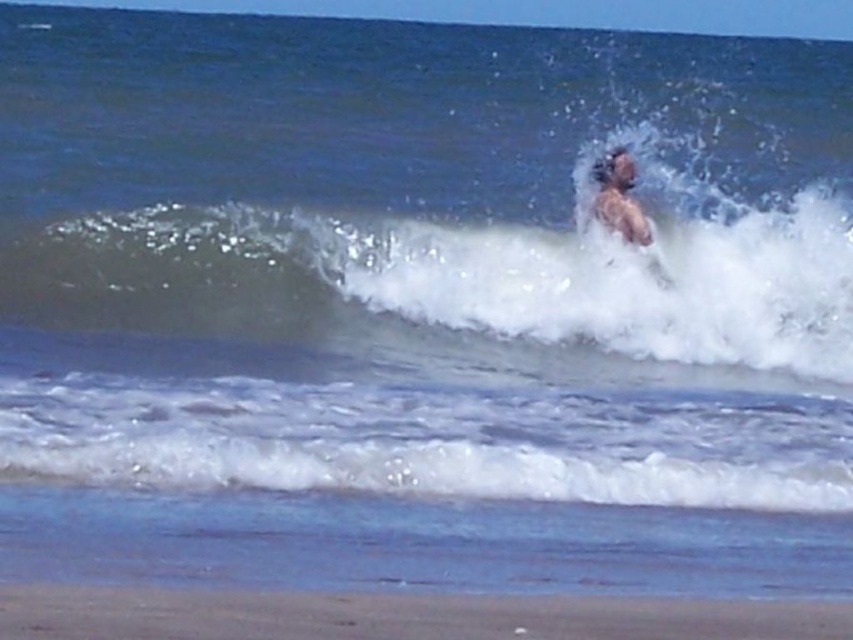
Who is lower down, white frothy wave at upper center or smooth sand at lower center?

smooth sand at lower center

Which is behind, point (12, 280) or point (581, 634)?

The point (12, 280) is more distant.

Is point (560, 376) farther from camera compared to point (167, 604)?

Yes, point (560, 376) is farther from viewer.

The image size is (853, 640). I want to click on white frothy wave at upper center, so pyautogui.click(x=462, y=289).

Is point (103, 605) positioned behind point (625, 157)?

No, (103, 605) is closer to viewer.

Which is in front, point (108, 586) or point (630, 204)?

Positioned in front is point (108, 586).

Is point (308, 630) in front of point (622, 172)?

That is True.

Find the location of a particular element. This screenshot has height=640, width=853. smooth sand at lower center is located at coordinates (399, 614).

Which is below, white frothy wave at upper center or light brown hair at upper center?

Positioned lower is white frothy wave at upper center.

Can you confirm if white frothy wave at upper center is smaller than light brown hair at upper center?

Actually, white frothy wave at upper center might be larger than light brown hair at upper center.

This screenshot has height=640, width=853. What do you see at coordinates (462, 289) in the screenshot?
I see `white frothy wave at upper center` at bounding box center [462, 289].

At what (x,y) coordinates should I click in order to perform the action: click on white frothy wave at upper center. Please return your answer as a coordinate pair (x, y). Image resolution: width=853 pixels, height=640 pixels. Looking at the image, I should click on (462, 289).